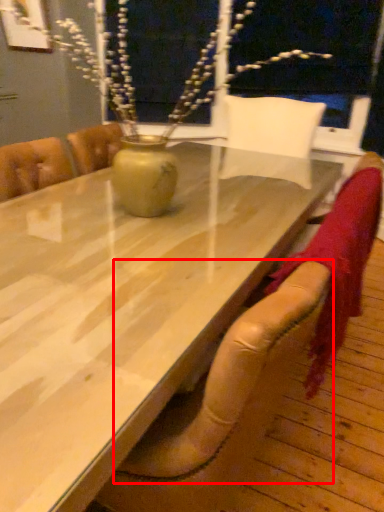
Question: Observing the image, what is the correct spatial positioning of armchair (annotated by the red box) in reference to table?

Choices:
 (A) right
 (B) left

Answer: (A)